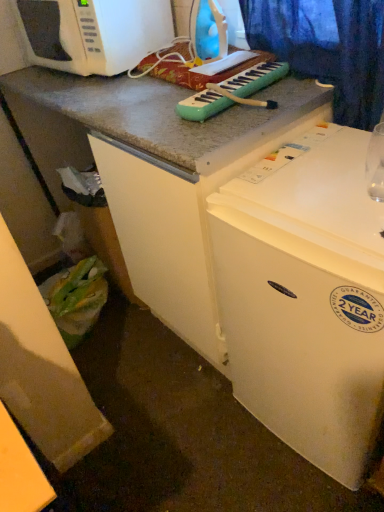
Question: Is white matte microwave oven at upper left completely or partially inside white matte refrigerator at upper right?

Choices:
 (A) no
 (B) yes

Answer: (A)

Question: Does white matte refrigerator at upper right appear on the right side of white matte microwave oven at upper left?

Choices:
 (A) yes
 (B) no

Answer: (A)

Question: Can you confirm if white matte refrigerator at upper right is bigger than white matte microwave oven at upper left?

Choices:
 (A) no
 (B) yes

Answer: (B)

Question: Is white matte refrigerator at upper right turned away from white matte microwave oven at upper left?

Choices:
 (A) yes
 (B) no

Answer: (B)

Question: Does white matte refrigerator at upper right turn towards white matte microwave oven at upper left?

Choices:
 (A) no
 (B) yes

Answer: (A)

Question: Is white matte refrigerator at upper right to the left or to the right of teal plastic musical keyboard at center in the image?

Choices:
 (A) right
 (B) left

Answer: (A)

Question: From a real-world perspective, is white matte refrigerator at upper right physically located above or below teal plastic musical keyboard at center?

Choices:
 (A) above
 (B) below

Answer: (B)

Question: Do you think white matte refrigerator at upper right is within teal plastic musical keyboard at center, or outside of it?

Choices:
 (A) inside
 (B) outside

Answer: (B)

Question: Is point (236, 179) closer or farther from the camera than point (283, 69)?

Choices:
 (A) farther
 (B) closer

Answer: (B)

Question: Does point (367, 303) appear closer or farther from the camera than point (372, 165)?

Choices:
 (A) closer
 (B) farther

Answer: (A)

Question: In terms of height, does white matte refrigerator at upper right look taller or shorter compared to transparent glass at upper right?

Choices:
 (A) short
 (B) tall

Answer: (B)

Question: From a real-world perspective, relative to transparent glass at upper right, is white matte refrigerator at upper right vertically above or below?

Choices:
 (A) above
 (B) below

Answer: (B)

Question: Considering the positions of white matte refrigerator at upper right and transparent glass at upper right in the image, is white matte refrigerator at upper right wider or thinner than transparent glass at upper right?

Choices:
 (A) thin
 (B) wide

Answer: (B)

Question: From a real-world perspective, relative to transparent glass at upper right, is teal plastic musical keyboard at center vertically above or below?

Choices:
 (A) below
 (B) above

Answer: (B)

Question: Considering the positions of teal plastic musical keyboard at center and transparent glass at upper right in the image, is teal plastic musical keyboard at center bigger or smaller than transparent glass at upper right?

Choices:
 (A) big
 (B) small

Answer: (A)